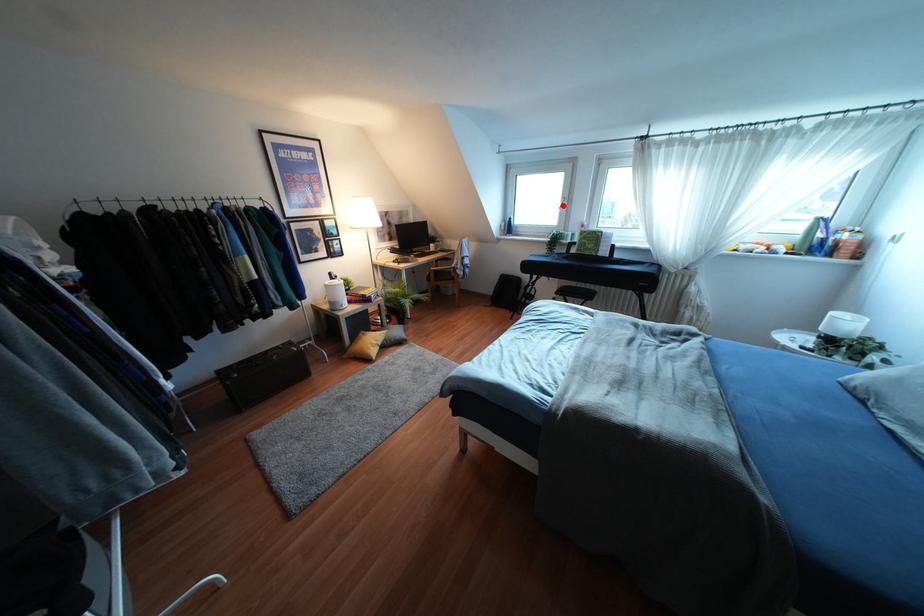
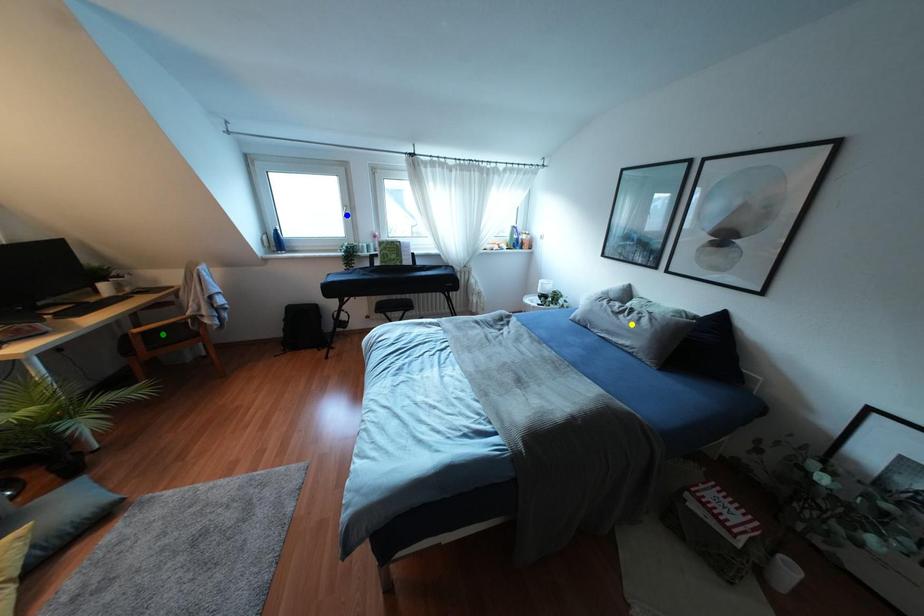
Question: I am providing you with two images of the same scene from different viewpoints. A red point is marked on the first image. You are given multiple points on the second image. Which point in image 2 is actually the same real-world point as the red point in image 1?

Choices:
 (A) green point
 (B) blue point
 (C) yellow point

Answer: (B)